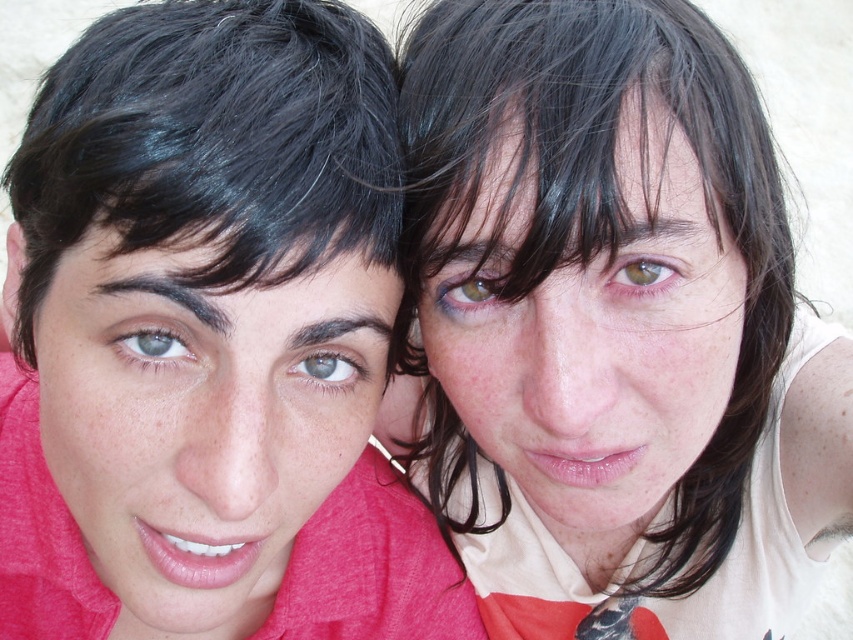
Does dry matte skin at center have a lesser width compared to gray matte eye at center?

No.

Is dry matte skin at center positioned in front of gray matte eye at center?

Yes, dry matte skin at center is closer to the viewer.

Where is `dry matte skin at center`? dry matte skin at center is located at coordinates (585, 326).

Is dry matte skin at center taller than black shiny hair at left?

Yes, dry matte skin at center is taller than black shiny hair at left.

Who is positioned more to the left, dry matte skin at center or black shiny hair at left?

Positioned to the left is black shiny hair at left.

Is point (612, 374) positioned after point (204, 225)?

Yes, it is.

Find the location of a particular element. dry matte skin at center is located at coordinates (585, 326).

Between point (164, 342) and point (614, 288), which one is positioned in front?

Point (164, 342) is in front.

Between green matte eye at center and green matte eye at upper center, which one appears on the left side from the viewer's perspective?

green matte eye at center

Locate an element on the screen. green matte eye at center is located at coordinates (152, 342).